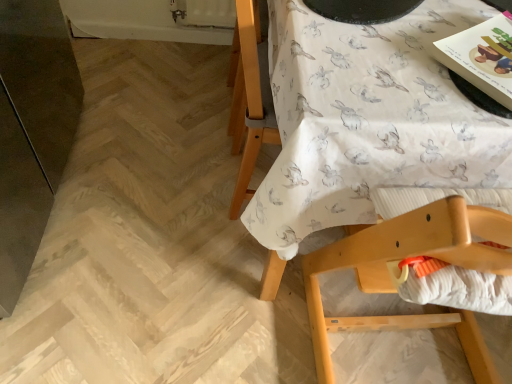
I want to click on vacant space situated on the left part of wooden highchair at upper right, so click(x=240, y=309).